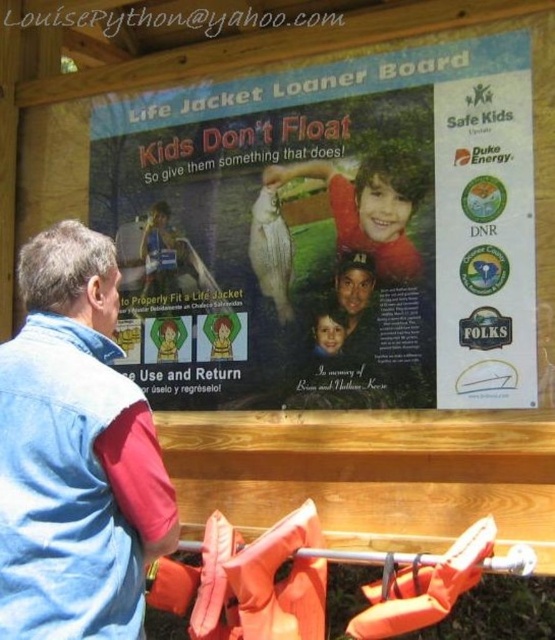
You are a visitor at the boathouse and see the blue denim jacket at left and the smooth red shirt at center. Which clothing item is nearer to you?

The blue denim jacket at left is closer to the viewer than the smooth red shirt at center.

What is the position of the blue denim jacket at left relative to the smooth red shirt at center in the image?

The blue denim jacket at left is positioned to the left of the smooth red shirt at center.

What is the location of the point marked at coordinates (329, 232) in the image?

The point marked at coordinates (329, 232) in the image is located at the center of the matte paper poster.